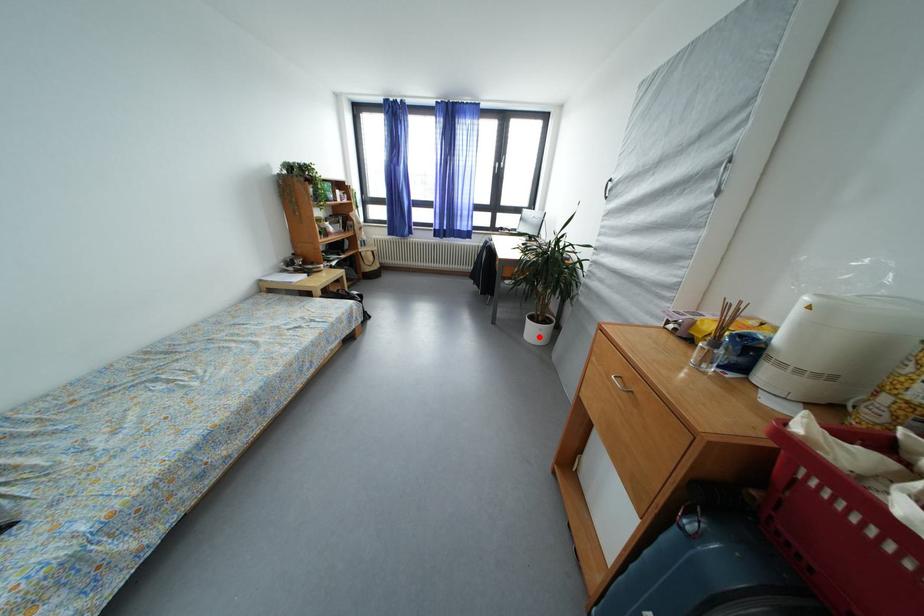
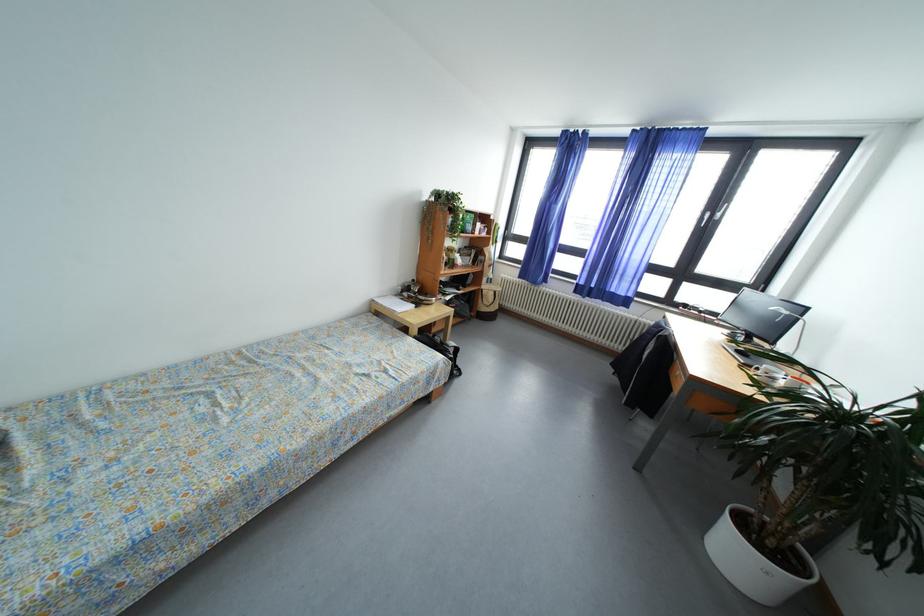
Where in the second image is the point corresponding to the highlighted location from the first image?

(745, 561)